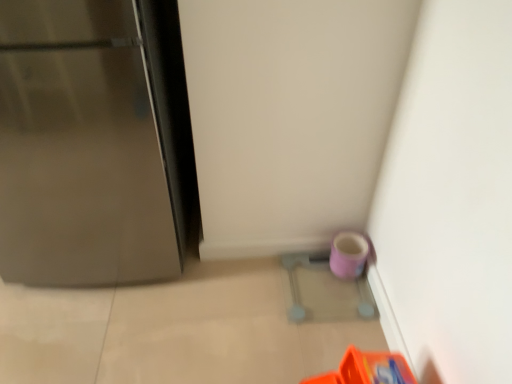
Find the location of a particular element. This screenshot has width=512, height=384. satin metallic door at left is located at coordinates (84, 146).

What do you see at coordinates (84, 146) in the screenshot?
I see `satin metallic door at left` at bounding box center [84, 146].

The height and width of the screenshot is (384, 512). I want to click on satin metallic door at left, so click(x=84, y=146).